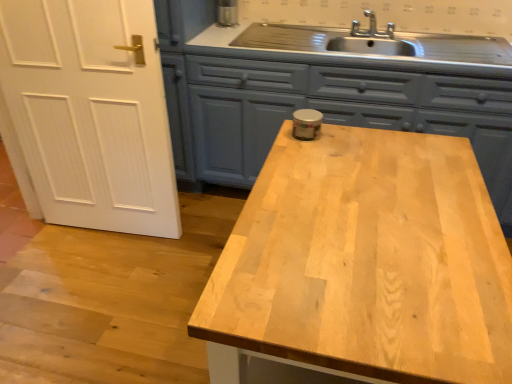
Question: From a real-world perspective, does matte blue cabinetry at center sit lower than light wood countertop at center?

Choices:
 (A) no
 (B) yes

Answer: (B)

Question: Is matte blue cabinetry at center oriented towards light wood countertop at center?

Choices:
 (A) no
 (B) yes

Answer: (B)

Question: Considering the relative sizes of matte blue cabinetry at center and light wood countertop at center in the image provided, is matte blue cabinetry at center smaller than light wood countertop at center?

Choices:
 (A) no
 (B) yes

Answer: (A)

Question: Does matte blue cabinetry at center have a lesser width compared to light wood countertop at center?

Choices:
 (A) no
 (B) yes

Answer: (A)

Question: From a real-world perspective, is matte blue cabinetry at center located higher than light wood countertop at center?

Choices:
 (A) yes
 (B) no

Answer: (B)

Question: Would you say matte blue cabinetry at center contains light wood countertop at center?

Choices:
 (A) yes
 (B) no

Answer: (B)

Question: Is the position of light wood countertop at center more distant than that of matte blue cabinetry at center?

Choices:
 (A) no
 (B) yes

Answer: (A)

Question: Does light wood countertop at center have a greater width compared to matte blue cabinetry at center?

Choices:
 (A) yes
 (B) no

Answer: (B)

Question: Is light wood countertop at center not within matte blue cabinetry at center?

Choices:
 (A) yes
 (B) no

Answer: (A)

Question: Could you tell me if light wood countertop at center is facing matte blue cabinetry at center?

Choices:
 (A) no
 (B) yes

Answer: (A)

Question: Is light wood countertop at center positioned in front of matte blue cabinetry at center?

Choices:
 (A) yes
 (B) no

Answer: (A)

Question: Does light wood countertop at center have a larger size compared to matte blue cabinetry at center?

Choices:
 (A) yes
 (B) no

Answer: (B)

Question: Considering the relative positions of matte blue cabinetry at center and light wood countertop at center in the image provided, is matte blue cabinetry at center to the left or to the right of light wood countertop at center?

Choices:
 (A) left
 (B) right

Answer: (B)